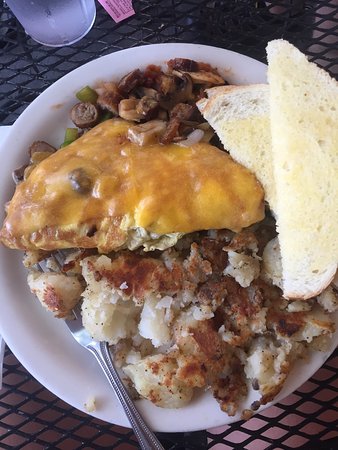
Identify the location of fork. (114, 381).